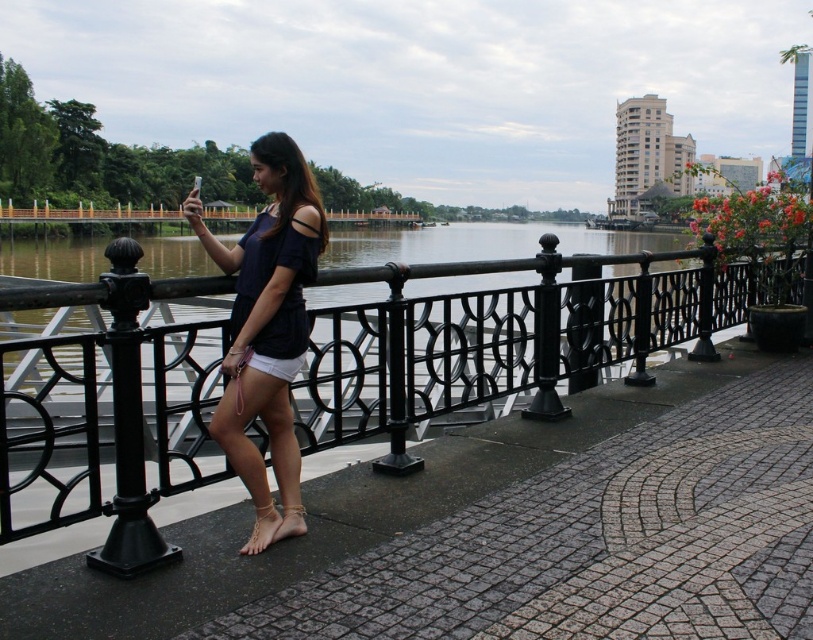
Question: Is black wrought iron fence at center above gold metallic anklet at lower center?

Choices:
 (A) yes
 (B) no

Answer: (A)

Question: Which point is closer to the camera taking this photo?

Choices:
 (A) (341, 339)
 (B) (268, 540)
 (C) (285, 234)
 (D) (300, 524)

Answer: (B)

Question: Which of the following is the farthest from the observer?

Choices:
 (A) (516, 392)
 (B) (281, 515)
 (C) (274, 508)

Answer: (A)

Question: Is the position of matte blue top at center more distant than that of gold metallic anklet at lower center?

Choices:
 (A) no
 (B) yes

Answer: (B)

Question: Is black wrought iron fence at center below matte blue top at center?

Choices:
 (A) yes
 (B) no

Answer: (A)

Question: Estimate the real-world distances between objects in this image. Which object is closer to the black wrought iron fence at center?

Choices:
 (A) clear plastic anklet at lower center
 (B) gold metallic anklet at lower center

Answer: (A)